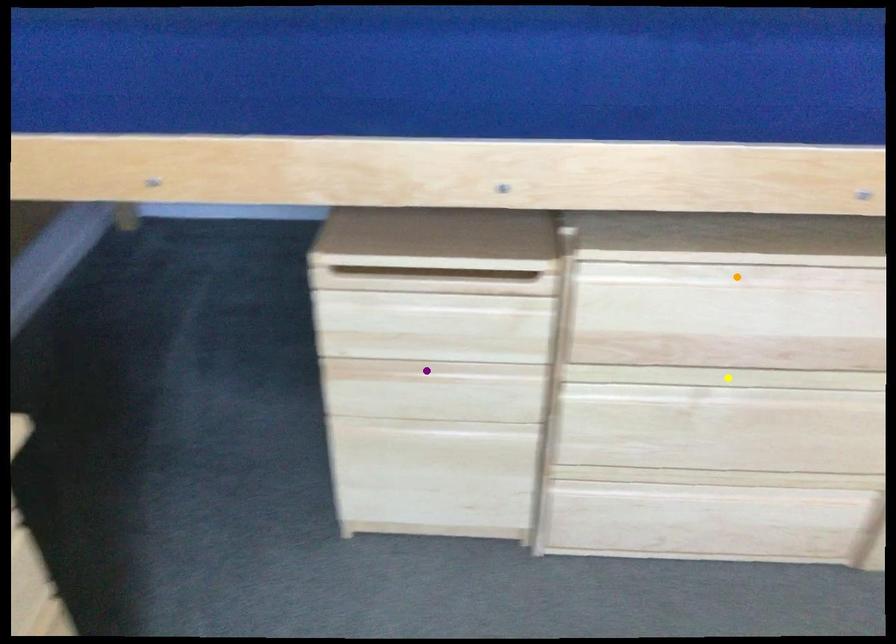
Order these from nearest to farthest:
A) purple point
B) yellow point
C) orange point

orange point
yellow point
purple point